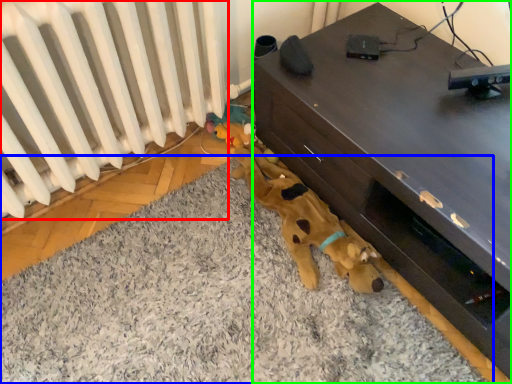
Question: Which object is positioned farthest from radiator (highlighted by a red box)? Select from mat (highlighted by a blue box) and furniture (highlighted by a green box).

Choices:
 (A) mat
 (B) furniture

Answer: (B)